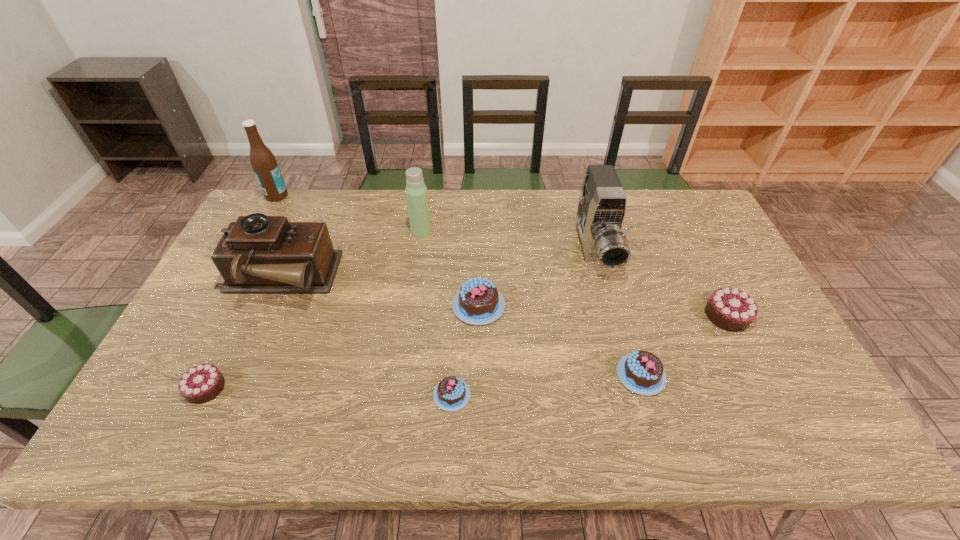
Locate an element on the screen. the second biggest pink chocolate cake is located at coordinates (642, 372).

Where is `the nearer chocolate chocolate cake`? The height and width of the screenshot is (540, 960). the nearer chocolate chocolate cake is located at coordinates (200, 384).

Locate an element on the screen. This screenshot has height=540, width=960. the smaller chocolate chocolate cake is located at coordinates (200, 384).

Find the location of a particular element. The image size is (960, 540). the shortest object is located at coordinates (451, 394).

The height and width of the screenshot is (540, 960). What are the coordinates of `the smallest pink chocolate cake` in the screenshot? It's located at (451, 394).

This screenshot has width=960, height=540. What are the coordinates of `blank space located 0.210m on the front of the tallest object` in the screenshot? It's located at (252, 241).

This screenshot has height=540, width=960. I want to click on vacant space located at the front of the camcorder, highlighting the lens, so click(x=615, y=325).

What are the coordinates of `vacant space located 0.120m on the right of the thermos bottle` in the screenshot? It's located at (467, 231).

Identify the location of vacant area situated 0.080m on the horn of the phonograph_record. This screenshot has height=540, width=960. (361, 280).

You are a GUI agent. You are given a task and a screenshot of the screen. Output one action in this format:
    pyautogui.click(x=<x>, y=<y>)
    Task: Click on the vacant point located on the right of the farthest pink chocolate cake
    This screenshot has height=540, width=960.
    Given the screenshot: What is the action you would take?
    pyautogui.click(x=611, y=306)